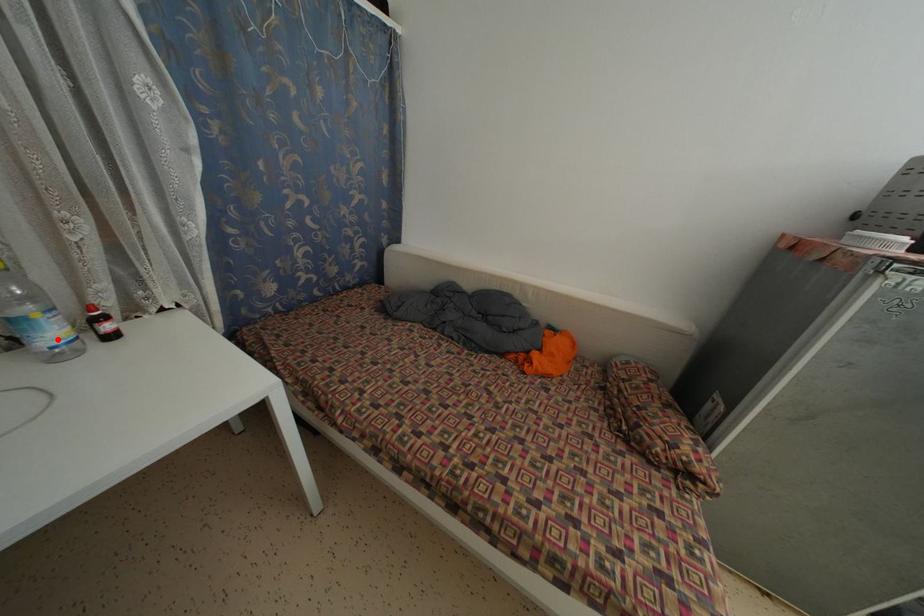
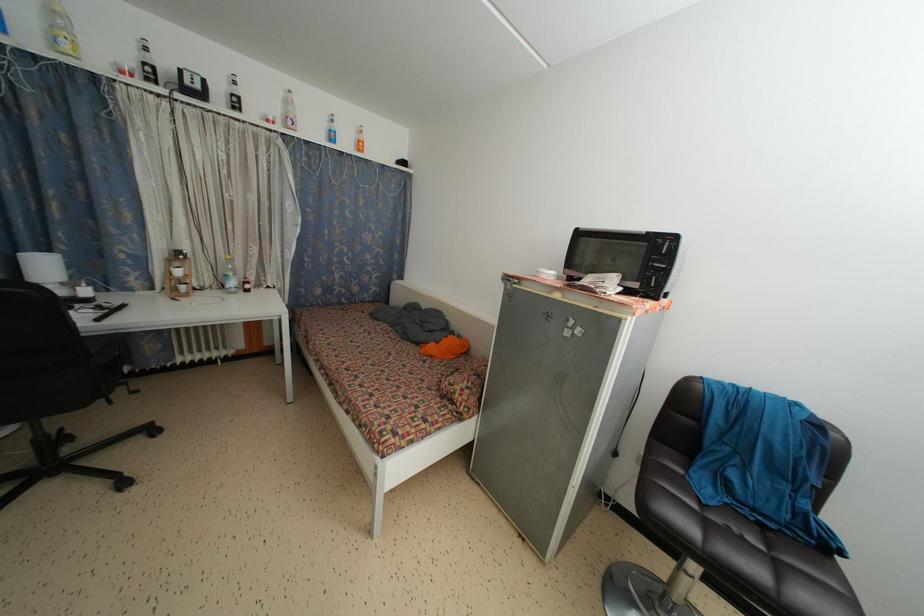
The point at the highlighted location is marked in the first image. Where is the corresponding point in the second image?

(237, 289)